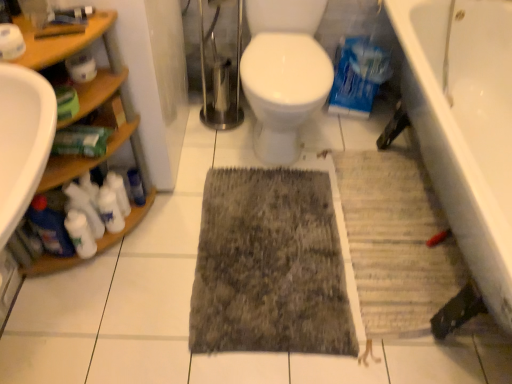
This screenshot has height=384, width=512. I want to click on empty space that is to the right of woodenshelves at left, so click(191, 241).